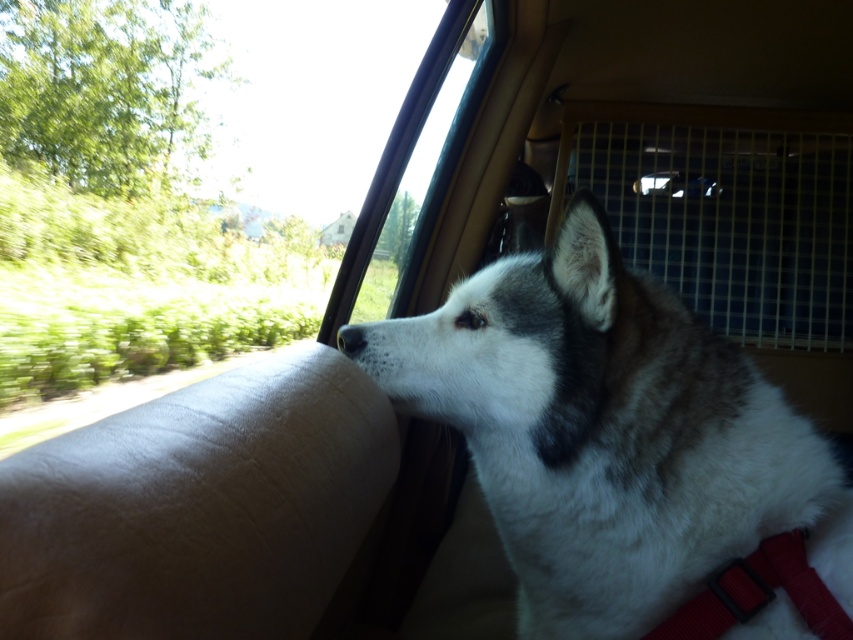
You are a passenger in the car and want to know if the white fur dog at center can fit through the transparent glass window at upper center. Can it?

The white fur dog at center has a lesser width compared to the transparent glass window at upper center, so the dog can fit through the window.

You are a passenger in the back seat of the vehicle and want to look at the scenery outside. The transparent glass window at upper center and the white fur at center are both in your view. Which object is located to the left when you look towards them?

The transparent glass window at upper center is to the left of the white fur at center, so when looking towards them, the transparent glass window at upper center is on the left side.

You are a passenger in the vehicle and want to see the outside view clearly. You notice the transparent glass window at upper center and the white fur at center. Which object allows you to see outside better?

The transparent glass window at upper center allows you to see outside better because it is wider than the white fur at center.